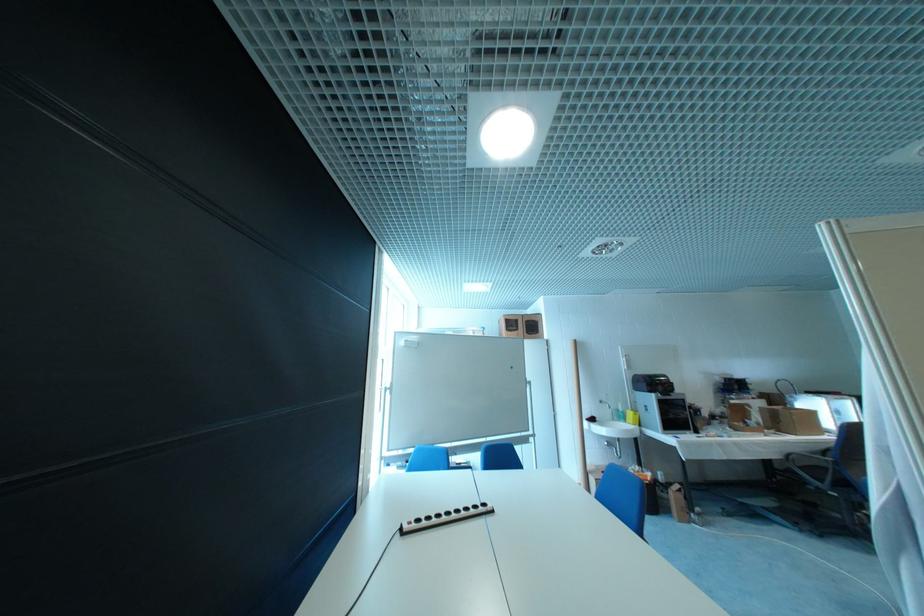
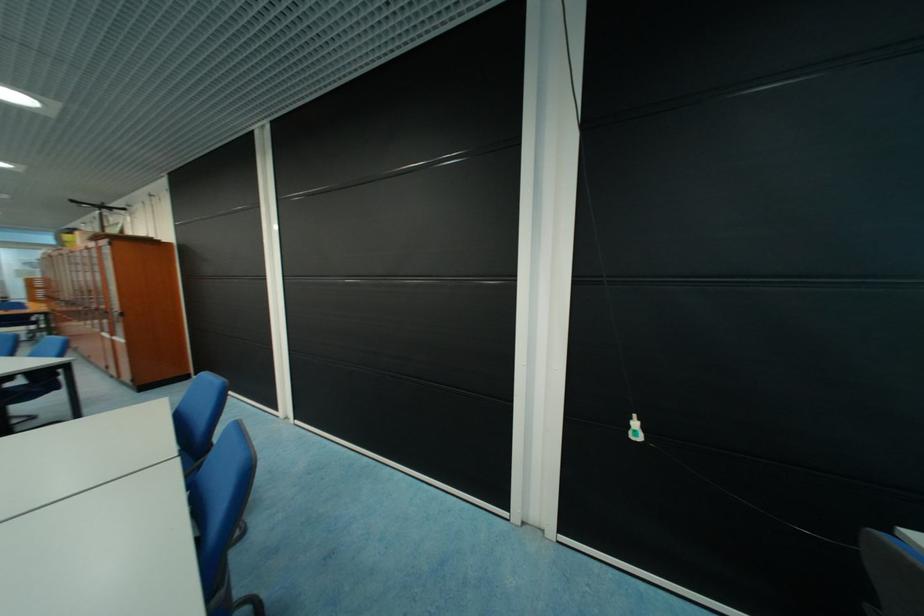
Question: The first image is from the beginning of the video and the second image is from the end. How did the camera likely rotate when shooting the video?

Choices:
 (A) Left
 (B) Right
 (C) Up
 (D) Down

Answer: (A)